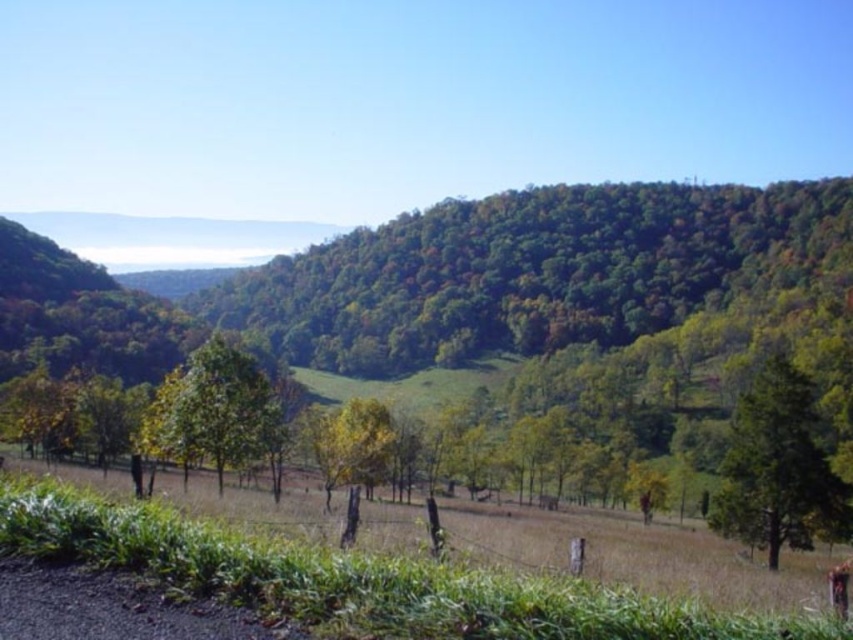
You are standing in the rural landscape and want to walk towards the green leafy tree at lower right. Which direction should you go relative to the green matte tree at center?

The green leafy tree at lower right is positioned under the green matte tree at center, so you should walk downward towards the green leafy tree at lower right.

You are standing in the rural landscape and see both the green leafy tree at center and the green matte tree at center. Which tree is positioned to the right when facing the scene?

The green leafy tree at center is positioned to the right of the green matte tree at center.

You are planning to plant a new tree in your backyard and want to choose between the green leafy tree at lower right and the green matte tree at center. Based on their heights, which one would you choose if you want a taller tree?

The green leafy tree at lower right has a greater height compared to the green matte tree at center, so you should choose the green leafy tree at lower right if you want a taller tree.